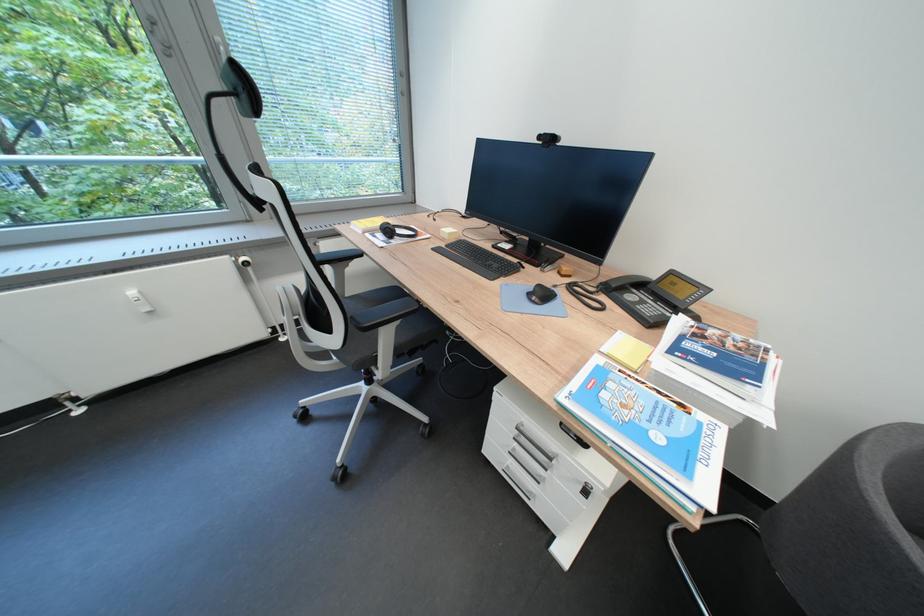
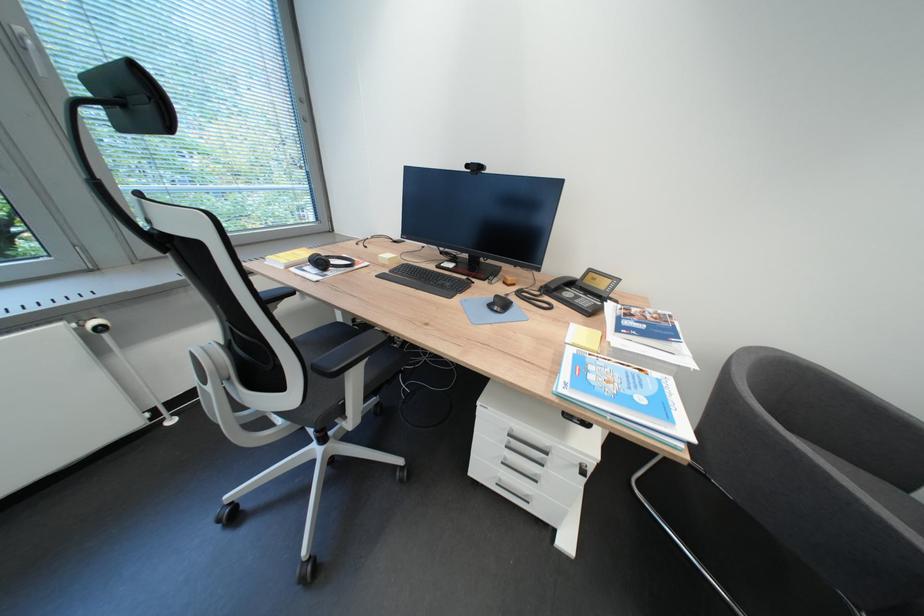
Question: The camera is either moving clockwise (left) or counter-clockwise (right) around the object. The first image is from the beginning of the video and the second image is from the end. Is the camera moving left or right when shooting the video?

Choices:
 (A) Left
 (B) Right

Answer: (A)